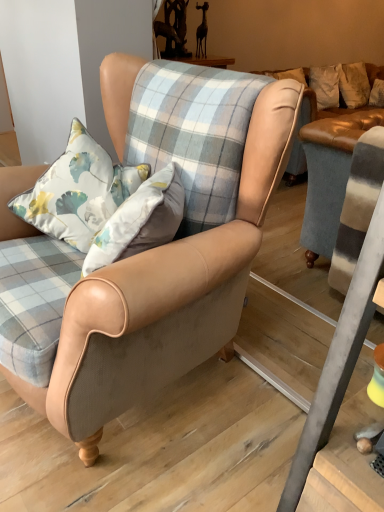
Question: Should I look upward or downward to see matte leather armchair at center?

Choices:
 (A) down
 (B) up

Answer: (B)

Question: Is floral fabric cushion at center behind matte leather armchair at center?

Choices:
 (A) no
 (B) yes

Answer: (B)

Question: From a real-world perspective, is floral fabric cushion at center physically below matte leather armchair at center?

Choices:
 (A) yes
 (B) no

Answer: (B)

Question: Is matte leather armchair at center located within floral fabric cushion at center?

Choices:
 (A) no
 (B) yes

Answer: (A)

Question: Can you confirm if floral fabric cushion at center is positioned to the left of matte leather armchair at center?

Choices:
 (A) no
 (B) yes

Answer: (B)

Question: Considering the relative sizes of floral fabric cushion at center and matte leather armchair at center in the image provided, is floral fabric cushion at center bigger than matte leather armchair at center?

Choices:
 (A) no
 (B) yes

Answer: (A)

Question: Is floral fabric cushion at center facing towards matte leather armchair at center?

Choices:
 (A) yes
 (B) no

Answer: (A)

Question: Considering the relative positions of matte leather armchair at center and floral fabric cushion at center in the image provided, is matte leather armchair at center to the left of floral fabric cushion at center from the viewer's perspective?

Choices:
 (A) yes
 (B) no

Answer: (B)

Question: Is there a large distance between matte leather armchair at center and floral fabric cushion at center?

Choices:
 (A) yes
 (B) no

Answer: (B)

Question: Is floral fabric cushion at center a part of matte leather armchair at center?

Choices:
 (A) no
 (B) yes

Answer: (B)

Question: From the image's perspective, does matte leather armchair at center appear lower than floral fabric cushion at center?

Choices:
 (A) no
 (B) yes

Answer: (B)

Question: Is matte leather armchair at center facing away from floral fabric cushion at center?

Choices:
 (A) yes
 (B) no

Answer: (A)

Question: Is matte leather armchair at center not within floral fabric cushion at center?

Choices:
 (A) yes
 (B) no

Answer: (A)

Question: Is matte leather armchair at center taller or shorter than floral fabric cushion at center?

Choices:
 (A) short
 (B) tall

Answer: (B)